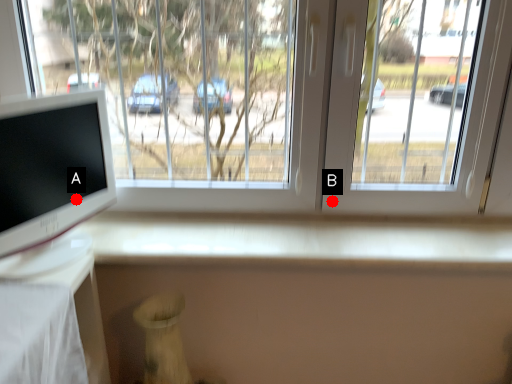
Question: Two points are circled on the image, labeled by A and B beside each circle. Which point appears closest to the camera in this image?

Choices:
 (A) A is closer
 (B) B is closer

Answer: (A)